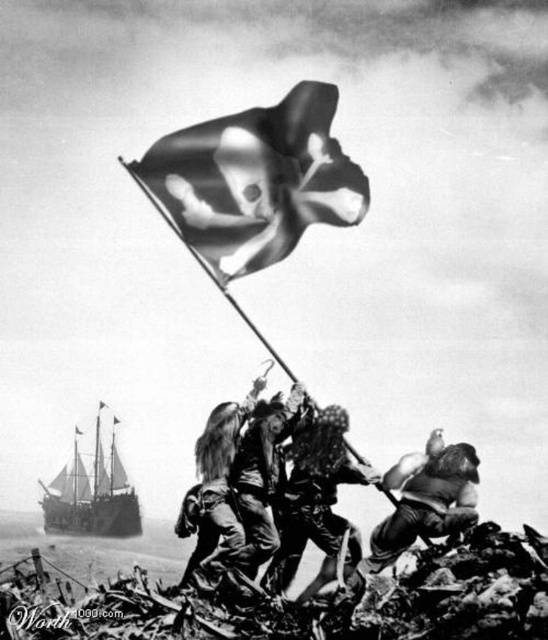
Locate an element on the screen. The height and width of the screenshot is (640, 548). rugged leather helmet at lower right is located at coordinates (424, 500).

Is point (442, 451) positioned behind point (75, 428)?

No, it is not.

Is point (437, 502) farther from viewer compared to point (81, 435)?

No, (437, 502) is in front of (81, 435).

You are a GUI agent. You are given a task and a screenshot of the screen. Output one action in this format:
    pyautogui.click(x=<x>, y=<y>)
    Task: Click on the rugged leather helmet at lower right
    This screenshot has height=640, width=548.
    Given the screenshot: What is the action you would take?
    pyautogui.click(x=424, y=500)

Who is positioned more to the right, rugged canvas flag at center or ruffled fabric pirate flag at center?

rugged canvas flag at center

Can you confirm if rugged canvas flag at center is shorter than ruffled fabric pirate flag at center?

In fact, rugged canvas flag at center may be taller than ruffled fabric pirate flag at center.

Is point (256, 536) positioned in front of point (99, 410)?

Yes, point (256, 536) is in front of point (99, 410).

Find the location of a particular element. Image resolution: width=548 pixels, height=640 pixels. rugged canvas flag at center is located at coordinates (243, 483).

Who is higher up, rugged fabric soldier at center or rugged leather helmet at lower right?

rugged fabric soldier at center is higher up.

Is rugged fabric soldier at center to the left of rugged leather helmet at lower right from the viewer's perspective?

Yes, rugged fabric soldier at center is to the left of rugged leather helmet at lower right.

At what (x,y) coordinates should I click in order to perform the action: click on rugged fabric soldier at center. Please return your answer as a coordinate pair (x, y). Image resolution: width=548 pixels, height=640 pixels. Looking at the image, I should click on (316, 502).